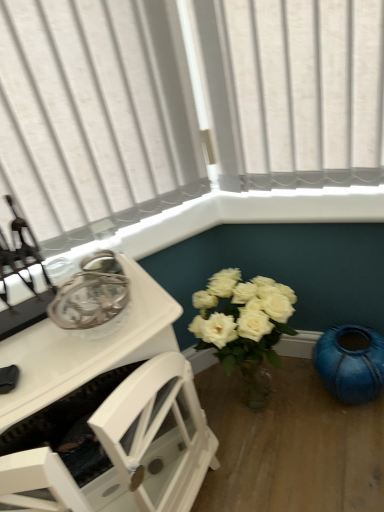
Question: Based on their sizes in the image, would you say teal glossy vase at lower right is bigger or smaller than white glossy table at upper left?

Choices:
 (A) small
 (B) big

Answer: (B)

Question: Does point (350, 344) appear closer or farther from the camera than point (36, 370)?

Choices:
 (A) closer
 (B) farther

Answer: (B)

Question: Would you say teal glossy vase at lower right is inside or outside white glossy table at upper left?

Choices:
 (A) outside
 (B) inside

Answer: (A)

Question: From the image's perspective, is white glossy table at upper left located above or below teal glossy vase at lower right?

Choices:
 (A) below
 (B) above

Answer: (B)

Question: In terms of width, does white glossy table at upper left look wider or thinner when compared to teal glossy vase at lower right?

Choices:
 (A) thin
 (B) wide

Answer: (B)

Question: Is white glossy table at upper left in front of or behind teal glossy vase at lower right in the image?

Choices:
 (A) front
 (B) behind

Answer: (A)

Question: From a real-world perspective, relative to teal glossy vase at lower right, is white glossy table at upper left vertically above or below?

Choices:
 (A) below
 (B) above

Answer: (B)